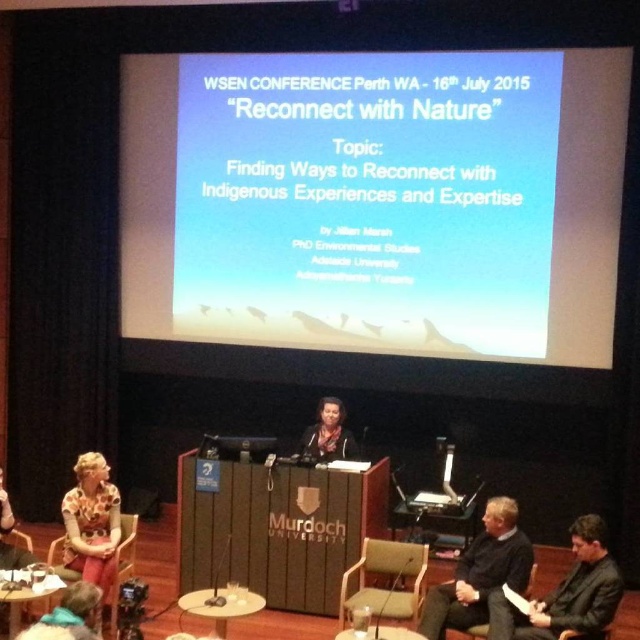
You are an attendee at the WSEN Conference and need to place a 1.2 meter tall presentation board on one of the wooden round tables. Which table should you choose between the wooden round table at center and the wooden round table at lower left to ensure the board doesn

The wooden round table at lower left is taller than the wooden round table at center. Therefore, the 1.2 meter tall presentation board should be placed on the wooden round table at lower left to ensure stability and visibility.